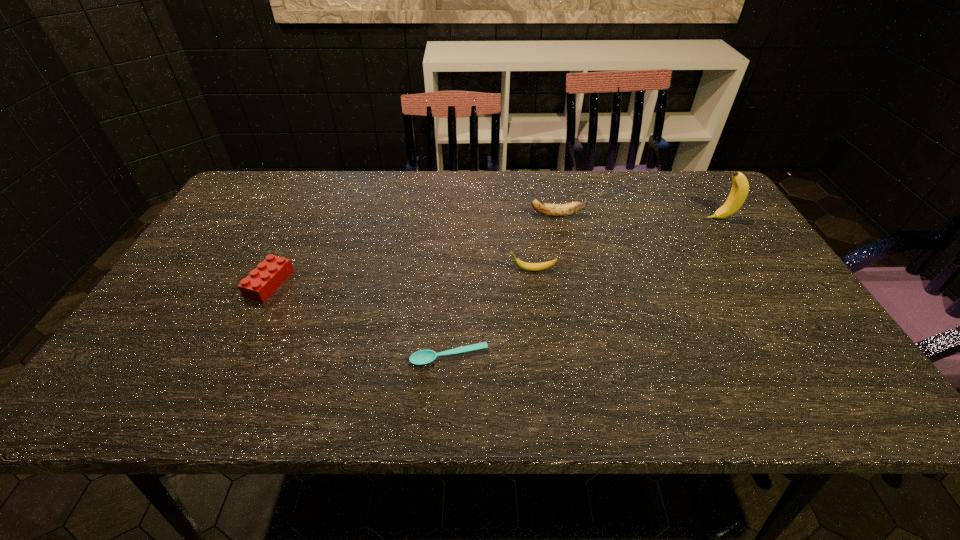
In order to click on the second closest banana to the fourth tallest object in this screenshot , I will do `click(555, 210)`.